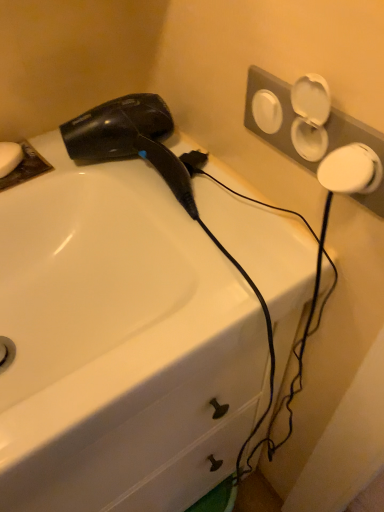
Question: Is black glossy hair dryer at upper left located outside white matte soap at upper left?

Choices:
 (A) no
 (B) yes

Answer: (B)

Question: Considering the relative sizes of black glossy hair dryer at upper left and white matte soap at upper left in the image provided, is black glossy hair dryer at upper left thinner than white matte soap at upper left?

Choices:
 (A) yes
 (B) no

Answer: (B)

Question: Does black glossy hair dryer at upper left appear on the left side of white matte soap at upper left?

Choices:
 (A) yes
 (B) no

Answer: (B)

Question: Does black glossy hair dryer at upper left have a larger size compared to white matte soap at upper left?

Choices:
 (A) no
 (B) yes

Answer: (B)

Question: Is black glossy hair dryer at upper left turned away from white matte soap at upper left?

Choices:
 (A) yes
 (B) no

Answer: (B)

Question: Considering the positions of white matte soap at upper left and black glossy hair dryer at upper left in the image, is white matte soap at upper left taller or shorter than black glossy hair dryer at upper left?

Choices:
 (A) short
 (B) tall

Answer: (A)

Question: Based on their positions, is white matte soap at upper left located to the left or right of black glossy hair dryer at upper left?

Choices:
 (A) left
 (B) right

Answer: (A)

Question: Is white matte soap at upper left wider or thinner than black glossy hair dryer at upper left?

Choices:
 (A) thin
 (B) wide

Answer: (A)

Question: Is point (1, 156) positioned closer to the camera than point (69, 135)?

Choices:
 (A) closer
 (B) farther

Answer: (B)

Question: Considering the positions of white glossy sink at upper left and white matte soap at upper left in the image, is white glossy sink at upper left taller or shorter than white matte soap at upper left?

Choices:
 (A) short
 (B) tall

Answer: (B)

Question: In terms of size, does white glossy sink at upper left appear bigger or smaller than white matte soap at upper left?

Choices:
 (A) small
 (B) big

Answer: (B)

Question: Based on their positions, is white glossy sink at upper left located to the left or right of white matte soap at upper left?

Choices:
 (A) right
 (B) left

Answer: (A)

Question: From a real-world perspective, is white glossy sink at upper left positioned above or below white matte soap at upper left?

Choices:
 (A) below
 (B) above

Answer: (A)

Question: Would you say black glossy hair dryer at upper left is to the left or to the right of white matte soap at upper left in the picture?

Choices:
 (A) left
 (B) right

Answer: (B)

Question: Considering their positions, is black glossy hair dryer at upper left located in front of or behind white matte soap at upper left?

Choices:
 (A) front
 (B) behind

Answer: (A)